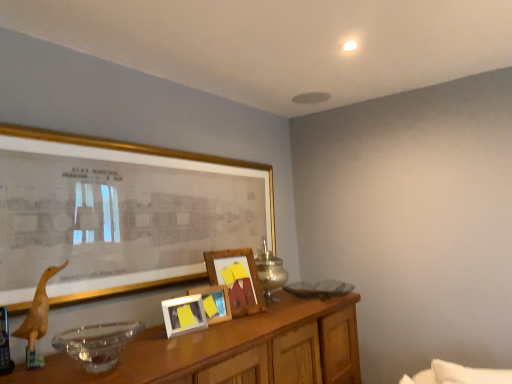
The height and width of the screenshot is (384, 512). In order to click on wooden picture frame at center, positioned as the first picture frame in back-to-front order in this screenshot , I will do `click(237, 279)`.

The image size is (512, 384). What are the coordinates of `matte gold picture frame at upper left, which ranks as the 4th picture frame in back-to-front order` in the screenshot? It's located at (137, 209).

Based on their positions, is matte wooden picture frame at center, which is the second picture frame in front-to-back order, located to the left or right of transparent glass bowl at center?

matte wooden picture frame at center, which is the second picture frame in front-to-back order, is positioned on transparent glass bowl at center's right side.

Which point is more distant from viewer, (202,312) or (120,324)?

The point (202,312) is behind.

From a real-world perspective, relative to transparent glass bowl at center, is matte wooden picture frame at center, which is the second picture frame in front-to-back order, vertically above or below?

Clearly, from a real-world perspective, matte wooden picture frame at center, which is the second picture frame in front-to-back order, is below transparent glass bowl at center.

This screenshot has width=512, height=384. What are the coordinates of `the 2nd picture frame behind when counting from the transparent glass bowl at center` in the screenshot? It's located at (184, 315).

Is the depth of wooden duckling at left less than that of matte wooden picture frame at center, which is the second picture frame in front-to-back order?

Yes.

How different are the orientations of wooden duckling at left and matte wooden picture frame at center, which is counted as the 3th picture frame, starting from the back, in degrees?

10.6 degrees.

Does wooden duckling at left have a lesser width compared to matte wooden picture frame at center, which is the second picture frame in front-to-back order?

No, wooden duckling at left is not thinner than matte wooden picture frame at center, which is the second picture frame in front-to-back order.

The width and height of the screenshot is (512, 384). In order to click on the 2nd picture frame behind the wooden duckling at left in this screenshot , I will do `click(184, 315)`.

Identify the location of table below the wooden duckling at left (from the image's perspective). This screenshot has width=512, height=384. [x=233, y=350].

Is wooden duckling at left spatially inside wooden table at lower center, or outside of it?

The correct answer is: outside.

Is wooden duckling at left placed right next to wooden table at lower center?

wooden duckling at left and wooden table at lower center are clearly separated.

Is wooden duckling at left at the left side of wooden table at lower center?

Yes, wooden duckling at left is to the left of wooden table at lower center.

Is point (255, 313) more distant than point (40, 291)?

Yes.

Considering the relative sizes of wooden picture frame at center, acting as the 4th picture frame starting from the front, and wooden duckling at left in the image provided, is wooden picture frame at center, acting as the 4th picture frame starting from the front, smaller than wooden duckling at left?

No.

Are wooden picture frame at center, positioned as the first picture frame in back-to-front order, and wooden duckling at left beside each other?

No, wooden picture frame at center, positioned as the first picture frame in back-to-front order, is not making contact with wooden duckling at left.

What's the angular difference between matte wooden picture frame at center, which is the second picture frame in front-to-back order, and wooden table at lower center's facing directions?

matte wooden picture frame at center, which is the second picture frame in front-to-back order, and wooden table at lower center are facing 10.6 degrees away from each other.

Can we say matte wooden picture frame at center, which is the second picture frame in front-to-back order, lies outside wooden table at lower center?

Yes.

Between matte wooden picture frame at center, which is counted as the 3th picture frame, starting from the back, and wooden table at lower center, which one has less height?

matte wooden picture frame at center, which is counted as the 3th picture frame, starting from the back, is shorter.

Who is bigger, matte wooden picture frame at center, which is counted as the 3th picture frame, starting from the back, or wooden table at lower center?

With larger size is wooden table at lower center.

Can you confirm if wooden picture frame at center, acting as the 4th picture frame starting from the front, is thinner than metallic silver table lamp at center?

Yes, wooden picture frame at center, acting as the 4th picture frame starting from the front, is thinner than metallic silver table lamp at center.

Is wooden picture frame at center, acting as the 4th picture frame starting from the front, positioned with its back to metallic silver table lamp at center?

wooden picture frame at center, acting as the 4th picture frame starting from the front, does not have its back to metallic silver table lamp at center.

Looking at this image, how many degrees apart are the facing directions of wooden picture frame at center, positioned as the first picture frame in back-to-front order, and metallic silver table lamp at center?

wooden picture frame at center, positioned as the first picture frame in back-to-front order, and metallic silver table lamp at center are facing 19.8 degrees away from each other.

From the image's perspective, between wooden picture frame at center, acting as the 4th picture frame starting from the front, and wooden table at lower center, who is located below?

wooden table at lower center, from the image's perspective.

Considering the relative sizes of wooden picture frame at center, acting as the 4th picture frame starting from the front, and wooden table at lower center in the image provided, is wooden picture frame at center, acting as the 4th picture frame starting from the front, bigger than wooden table at lower center?

No, wooden picture frame at center, acting as the 4th picture frame starting from the front, is not bigger than wooden table at lower center.

Does wooden picture frame at center, positioned as the first picture frame in back-to-front order, have a lesser height compared to wooden table at lower center?

Correct, wooden picture frame at center, positioned as the first picture frame in back-to-front order, is not as tall as wooden table at lower center.

In the scene shown: Is wooden picture frame at center, acting as the 4th picture frame starting from the front, closer to the viewer compared to wooden table at lower center?

No, it is behind wooden table at lower center.

From the image's perspective, which picture frame is the 2nd one below the transparent glass bowl at center? Please provide its 2D coordinates.

[(184, 315)]

In the image, there is a matte wooden picture frame at center, which is the second picture frame in front-to-back order. Where is `toy above it (from the image's perspective)`? toy above it (from the image's perspective) is located at coordinates (37, 319).

When comparing their distances from wooden picture frame at center, which is the 2th picture frame in back-to-front order, does transparent glass bowl at center or wooden table at lower center seem closer?

wooden table at lower center is positioned closer to the anchor wooden picture frame at center, which is the 2th picture frame in back-to-front order.

Considering their positions, is metallic silver table lamp at center positioned further to wooden duckling at left than matte wooden picture frame at center, which is the second picture frame in front-to-back order?

A: metallic silver table lamp at center.

Based on their spatial positions, is transparent glass bowl at center or metallic silver table lamp at center further from matte gold picture frame at upper left, placed as the 1th picture frame when sorted from front to back?

metallic silver table lamp at center.

Considering their positions, is transparent glass bowl at center positioned further to metallic silver table lamp at center than wooden picture frame at center, acting as the 4th picture frame starting from the front?

The object further to metallic silver table lamp at center is transparent glass bowl at center.

Looking at the image, which one is located closer to wooden table at lower center, matte wooden picture frame at center, which is counted as the 3th picture frame, starting from the back, or wooden duckling at left?

matte wooden picture frame at center, which is counted as the 3th picture frame, starting from the back, lies closer to wooden table at lower center than the other object.

Estimate the real-world distances between objects in this image. Which object is further from matte wooden picture frame at center, which is counted as the 3th picture frame, starting from the back, metallic silver table lamp at center or wooden picture frame at center, positioned as the first picture frame in back-to-front order?

Among the two, metallic silver table lamp at center is located further to matte wooden picture frame at center, which is counted as the 3th picture frame, starting from the back.

Which object lies nearer to the anchor point matte gold picture frame at upper left, which ranks as the 4th picture frame in back-to-front order, wooden duckling at left or transparent glass bowl at center?

wooden duckling at left lies closer to matte gold picture frame at upper left, which ranks as the 4th picture frame in back-to-front order, than the other object.

Considering their positions, is transparent glass bowl at center positioned further to wooden picture frame at center, positioned as the first picture frame in back-to-front order, than wooden table at lower center?

transparent glass bowl at center is further to wooden picture frame at center, positioned as the first picture frame in back-to-front order.

Locate an element on the screen. picture frame located between transparent glass bowl at center and matte wooden picture frame at center, which is the second picture frame in front-to-back order, in the depth direction is located at coordinates (137, 209).

This screenshot has height=384, width=512. I want to click on toy between transparent glass bowl at center and matte wooden picture frame at center, which is counted as the 3th picture frame, starting from the back, in the front-back direction, so click(x=37, y=319).

You are a GUI agent. You are given a task and a screenshot of the screen. Output one action in this format:
    pyautogui.click(x=<x>, y=<y>)
    Task: Click on the glass bowl located between wooden table at lower center and wooden picture frame at center, acting as the 4th picture frame starting from the front, in the depth direction
    The image size is (512, 384).
    Given the screenshot: What is the action you would take?
    pyautogui.click(x=97, y=343)

This screenshot has width=512, height=384. I want to click on toy that lies between matte gold picture frame at upper left, which ranks as the 4th picture frame in back-to-front order, and wooden table at lower center from top to bottom, so click(37, 319).